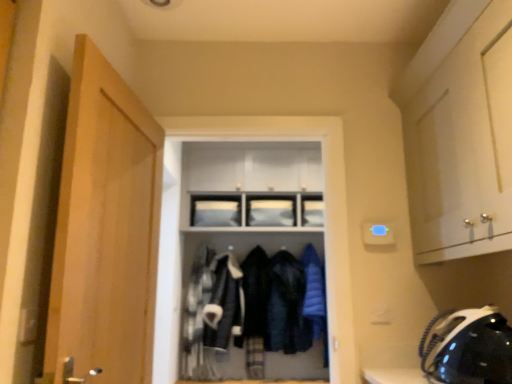
What is the approximate height of wooden door at left?

It is 1.18 meters.

Where is `velvet-like black coat at center, arranged as the second clothing when viewed from the left`? This screenshot has width=512, height=384. velvet-like black coat at center, arranged as the second clothing when viewed from the left is located at coordinates [255, 295].

I want to click on blue down jacket at center, so click(x=314, y=291).

What do you see at coordinates (287, 306) in the screenshot? This screenshot has width=512, height=384. I see `dark blue fabric jacket at center, the 3th clothing positioned from the left` at bounding box center [287, 306].

Where is `black matte helmet at lower right`? Image resolution: width=512 pixels, height=384 pixels. black matte helmet at lower right is located at coordinates (469, 348).

Find the location of a particular element. wooden door at left is located at coordinates (105, 229).

In order to click on dresser that appears above the dark blue fabric jacket at center, the first clothing positioned from the right (from the image's perspective) in this screenshot , I will do `click(252, 262)`.

From a real-world perspective, is matte black coat rack at center on top of dark blue fabric jacket at center, the first clothing positioned from the right?

Yes.

Is matte black coat rack at center in contact with dark blue fabric jacket at center, the 3th clothing positioned from the left?

There is a gap between matte black coat rack at center and dark blue fabric jacket at center, the 3th clothing positioned from the left.

Is matte black coat rack at center oriented away from dark blue fabric jacket at center, the 3th clothing positioned from the left?

Absolutely, matte black coat rack at center is directed away from dark blue fabric jacket at center, the 3th clothing positioned from the left.

Is velvet-like black coat at center, which is the 3th clothing from right to left, located outside white glossy cabinet at upper right, which appears as the 2th cabinetry when viewed from the left?

velvet-like black coat at center, which is the 3th clothing from right to left, lies outside white glossy cabinet at upper right, which appears as the 2th cabinetry when viewed from the left,'s area.

Considering the positions of point (223, 253) and point (447, 128), is point (223, 253) closer or farther from the camera than point (447, 128)?

Clearly, point (223, 253) is more distant from the camera than point (447, 128).

Where is `clothing that is the 3rd object to the left of the white glossy cabinet at upper right, which appears as the 2th cabinetry when viewed from the left, starting at the anchor`? clothing that is the 3rd object to the left of the white glossy cabinet at upper right, which appears as the 2th cabinetry when viewed from the left, starting at the anchor is located at coordinates (223, 303).

From a real-world perspective, is wooden door at left physically located above or below white glossy cabinet at upper right, which ranks as the first cabinetry in front-to-back order?

In terms of real-world spatial position, wooden door at left is below white glossy cabinet at upper right, which ranks as the first cabinetry in front-to-back order.

Consider the image. Is there a large distance between wooden door at left and white glossy cabinet at upper right, which ranks as the first cabinetry in front-to-back order?

Absolutely, wooden door at left is distant from white glossy cabinet at upper right, which ranks as the first cabinetry in front-to-back order.

Which is closer, (93,206) or (444,74)?

Point (93,206)

Image resolution: width=512 pixels, height=384 pixels. What are the coordinates of `door behind the white glossy cabinet at upper right, which appears as the 2th cabinetry when viewed from the left` in the screenshot? It's located at (105, 229).

Is point (303, 256) closer to camera compared to point (224, 300)?

No, it is behind (224, 300).

I want to click on the 3rd clothing counting from the left of the blue down jacket at center, so click(223, 303).

Can you see blue down jacket at center touching velvet-like black coat at center, acting as the 1th clothing starting from the left?

blue down jacket at center and velvet-like black coat at center, acting as the 1th clothing starting from the left, are not in contact.

Looking at their sizes, would you say blue down jacket at center is wider or thinner than velvet-like black coat at center, which is the 3th clothing from right to left?

blue down jacket at center is thinner than velvet-like black coat at center, which is the 3th clothing from right to left.

Can you confirm if wooden door at left is taller than matte black coat rack at center?

In fact, wooden door at left may be shorter than matte black coat rack at center.

How different are the orientations of wooden door at left and matte black coat rack at center in degrees?

The angle between the facing direction of wooden door at left and the facing direction of matte black coat rack at center is 83.5 degrees.

Does wooden door at left have a lesser width compared to matte black coat rack at center?

Yes.

Is wooden door at left smaller than dark blue fabric jacket at center, the first clothing positioned from the right?

No.

Is wooden door at left positioned with its back to dark blue fabric jacket at center, the 3th clothing positioned from the left?

No, wooden door at left is not facing the opposite direction of dark blue fabric jacket at center, the 3th clothing positioned from the left.

In the scene shown: Would you consider wooden door at left to be distant from dark blue fabric jacket at center, the 3th clothing positioned from the left?

Indeed, wooden door at left is not near dark blue fabric jacket at center, the 3th clothing positioned from the left.

Considering the positions of objects wooden door at left and dark blue fabric jacket at center, the 3th clothing positioned from the left, in the image provided, who is in front, wooden door at left or dark blue fabric jacket at center, the 3th clothing positioned from the left,?

wooden door at left is closer to the camera.

Can you tell me how much velvet-like black coat at center, arranged as the second clothing when viewed from the left, and blue down jacket at center differ in facing direction?

0.000146 degrees separate the facing orientations of velvet-like black coat at center, arranged as the second clothing when viewed from the left, and blue down jacket at center.

Is velvet-like black coat at center, arranged as the second clothing when viewed from the left, oriented towards blue down jacket at center?

No.

In terms of size, does velvet-like black coat at center, placed as the second clothing when sorted from right to left, appear bigger or smaller than blue down jacket at center?

In the image, velvet-like black coat at center, placed as the second clothing when sorted from right to left, appears to be larger than blue down jacket at center.

Considering the sizes of velvet-like black coat at center, placed as the second clothing when sorted from right to left, and blue down jacket at center in the image, is velvet-like black coat at center, placed as the second clothing when sorted from right to left, wider or thinner than blue down jacket at center?

In the image, velvet-like black coat at center, placed as the second clothing when sorted from right to left, appears to be more narrow than blue down jacket at center.

The image size is (512, 384). In order to click on clothing that is the 3rd one when counting backward from the matte black coat rack at center in this screenshot , I will do `click(287, 306)`.

From a real-world perspective, count 1st cabinetrys upward from the velvet-like black coat at center, acting as the 1th clothing starting from the left, and point to it. Please provide its 2D coordinates.

[(464, 146)]

Considering their positions, is wooden door at left positioned further to matte white cabinet at upper center, the second cabinetry in the front-to-back sequence, than matte black coat rack at center?

wooden door at left.

Which object lies further to the anchor point velvet-like black coat at center, placed as the second clothing when sorted from right to left, black matte helmet at lower right or matte white cabinet at upper center, the second cabinetry in the front-to-back sequence?

black matte helmet at lower right lies further to velvet-like black coat at center, placed as the second clothing when sorted from right to left, than the other object.

Based on the photo, when comparing their distances from black matte helmet at lower right, does dark blue fabric jacket at center, the first clothing positioned from the right, or matte black coat rack at center seem closer?

dark blue fabric jacket at center, the first clothing positioned from the right.

Looking at the image, which one is located further to dark blue fabric jacket at center, the 3th clothing positioned from the left, blue down jacket at center or matte black coat rack at center?

matte black coat rack at center is further to dark blue fabric jacket at center, the 3th clothing positioned from the left.

From the image, which object appears to be nearer to velvet-like black coat at center, acting as the 1th clothing starting from the left, velvet-like black coat at center, placed as the second clothing when sorted from right to left, or dark blue fabric jacket at center, the first clothing positioned from the right?

Based on the image, velvet-like black coat at center, placed as the second clothing when sorted from right to left, appears to be nearer to velvet-like black coat at center, acting as the 1th clothing starting from the left.

Looking at the image, which one is located closer to velvet-like black coat at center, which is the 3th clothing from right to left, matte black coat rack at center or velvet-like black coat at center, placed as the second clothing when sorted from right to left?

velvet-like black coat at center, placed as the second clothing when sorted from right to left, lies closer to velvet-like black coat at center, which is the 3th clothing from right to left, than the other object.

From the image, which object appears to be nearer to black matte helmet at lower right, matte black coat rack at center or dark blue fabric jacket at center, the 3th clothing positioned from the left?

Among the two, dark blue fabric jacket at center, the 3th clothing positioned from the left, is located nearer to black matte helmet at lower right.

Estimate the real-world distances between objects in this image. Which object is further from velvet-like black coat at center, placed as the second clothing when sorted from right to left, blue down jacket at center or white glossy cabinet at upper right, arranged as the second cabinetry when viewed from the back?

The object further to velvet-like black coat at center, placed as the second clothing when sorted from right to left, is white glossy cabinet at upper right, arranged as the second cabinetry when viewed from the back.

I want to click on door between white glossy cabinet at upper right, the 1th cabinetry from the right, and dark blue fabric jacket at center, the first clothing positioned from the right, along the z-axis, so click(105, 229).

Where is `dresser between wooden door at left and blue down jacket at center in the front-back direction`? The image size is (512, 384). dresser between wooden door at left and blue down jacket at center in the front-back direction is located at coordinates (252, 262).

The width and height of the screenshot is (512, 384). I want to click on robe between matte white cabinet at upper center, marked as the 1th cabinetry in a back-to-front arrangement, and velvet-like black coat at center, placed as the second clothing when sorted from right to left, in the up-down direction, so click(x=314, y=291).

At what (x,y) coordinates should I click in order to perform the action: click on helmet between wooden door at left and matte black coat rack at center in the front-back direction. Please return your answer as a coordinate pair (x, y). Looking at the image, I should click on pos(469,348).